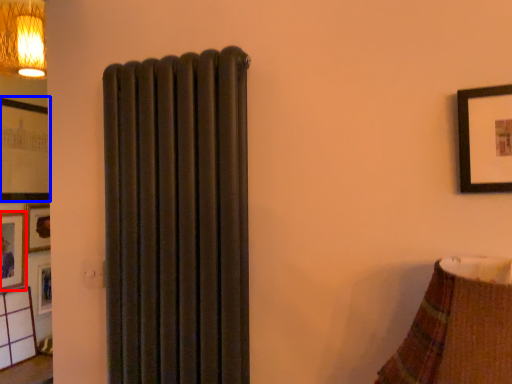
Question: Which point is further to the camera, picture frame (highlighted by a red box) or picture frame (highlighted by a blue box)?

Choices:
 (A) picture frame
 (B) picture frame

Answer: (B)